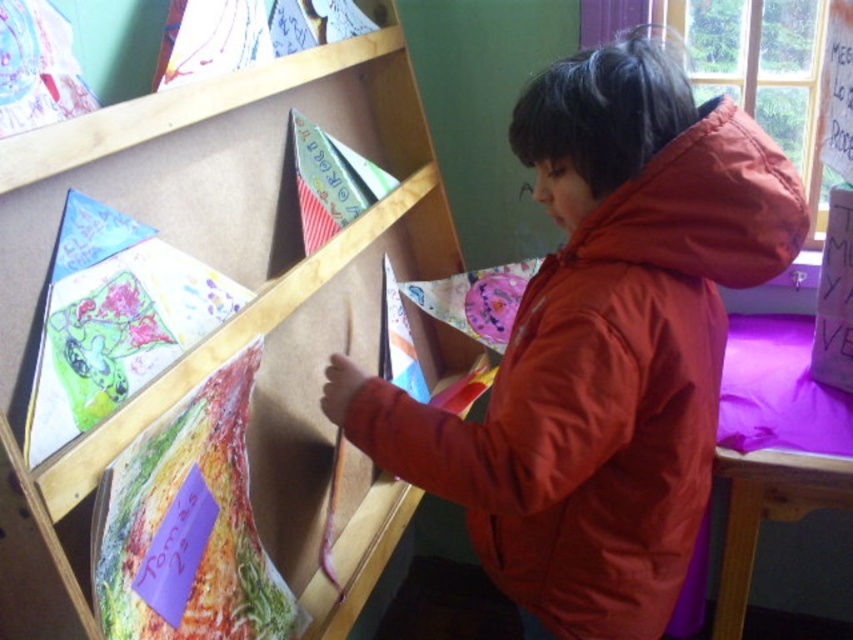
You are a visitor at an art exhibition and see the matte orange jacket at center and the wooden bookshelf at upper left. According to the scene, which object is positioned lower in the image?

The matte orange jacket at center is positioned below the wooden bookshelf at upper left, so it is lower in the image.

You are a photographer trying to capture the artwork on the shelf. You notice two points on the artwork pieces labeled as point (703, 122) and point (235, 83). Which point would appear larger in your photo?

Point (703, 122) is closer to the camera than point (235, 83), so it would appear larger in the photo.